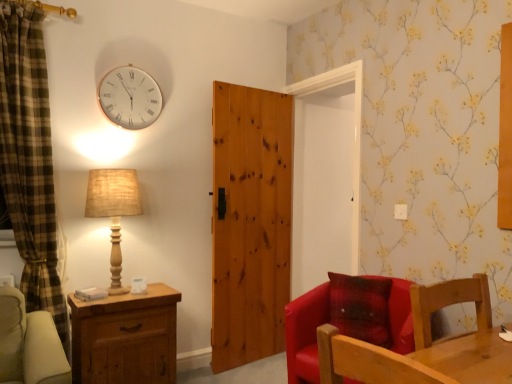
Question: Considering the positions of burlap lampshade at left and wooden chair at lower right, arranged as the first chair when viewed from the front, in the image, is burlap lampshade at left taller or shorter than wooden chair at lower right, arranged as the first chair when viewed from the front,?

Choices:
 (A) tall
 (B) short

Answer: (A)

Question: Is point (138, 205) closer or farther from the camera than point (446, 284)?

Choices:
 (A) farther
 (B) closer

Answer: (A)

Question: Which is farther from the burlap lampshade at left?

Choices:
 (A) white glass clock at upper left
 (B) matte red leather chair at center, the second chair positioned from the front
 (C) wooden chair at lower right, arranged as the first chair when viewed from the front
 (D) natural wood door at center
 (E) brown wooden chest of drawers at lower left

Answer: (C)

Question: Considering the real-world distances, which object is closest to the white glass clock at upper left?

Choices:
 (A) brown wooden chest of drawers at lower left
 (B) matte red leather chair at center, arranged as the 1th chair when viewed from the back
 (C) wooden chair at lower right, which is counted as the second chair, starting from the back
 (D) burlap lampshade at left
 (E) natural wood door at center

Answer: (D)